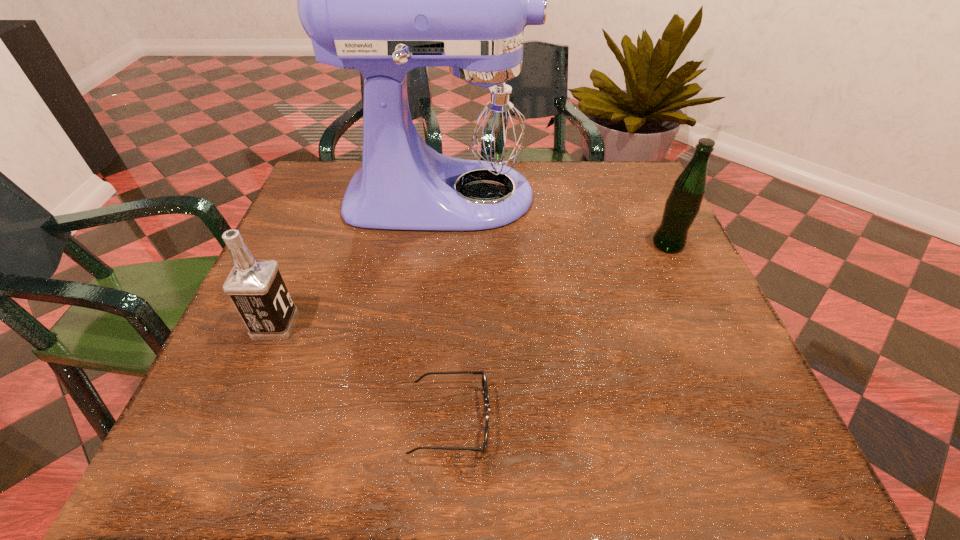
Find the location of a particular element. the tallest object is located at coordinates (383, 0).

The width and height of the screenshot is (960, 540). What are the coordinates of `beer bottle` in the screenshot? It's located at (683, 204).

Identify the location of the leftmost object. The height and width of the screenshot is (540, 960). [x=256, y=288].

At what (x,y) coordinates should I click in order to perform the action: click on the third farthest object. Please return your answer as a coordinate pair (x, y). Looking at the image, I should click on (256, 288).

I want to click on spectacles, so click(484, 381).

Where is `the shortest object`? The image size is (960, 540). the shortest object is located at coordinates (484, 381).

Identify the location of vacant space located 0.150m at the mixing area of the tallest object. (605, 196).

I want to click on vacant area situated 0.340m on the left of the beer bottle, so click(505, 244).

You are a GUI agent. You are given a task and a screenshot of the screen. Output one action in this format:
    pyautogui.click(x=<x>, y=<y>)
    Task: Click on the vacant space located on the front label of the second nearest object
    The width and height of the screenshot is (960, 540).
    Given the screenshot: What is the action you would take?
    pyautogui.click(x=357, y=325)

Find the location of a particular element. This screenshot has width=960, height=540. free region located on the front-facing side of the spectacles is located at coordinates [x=682, y=420].